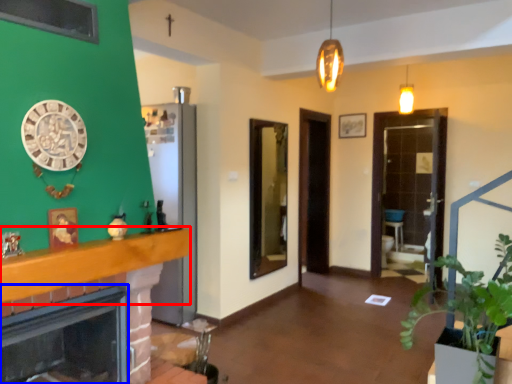
Question: Which object is further to the camera taking this photo, balustrade (highlighted by a red box) or fireplace (highlighted by a blue box)?

Choices:
 (A) balustrade
 (B) fireplace

Answer: (B)